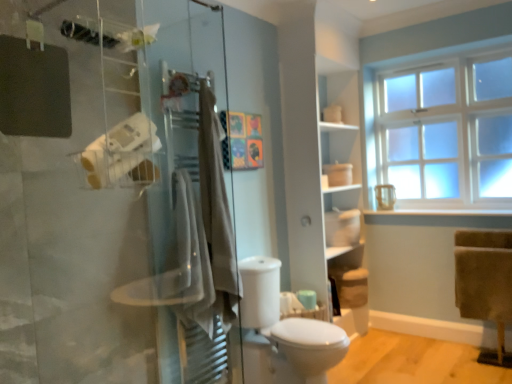
Question: Considering the relative sizes of beige cotton bath towel at center, which ranks as the second bath towel in back-to-front order, and white matte shelf at center in the image provided, is beige cotton bath towel at center, which ranks as the second bath towel in back-to-front order, smaller than white matte shelf at center?

Choices:
 (A) yes
 (B) no

Answer: (A)

Question: Does beige cotton bath towel at center, the 1th bath towel when ordered from front to back, have a larger size compared to white matte shelf at center?

Choices:
 (A) no
 (B) yes

Answer: (A)

Question: Is there a large distance between beige cotton bath towel at center, which ranks as the second bath towel in back-to-front order, and white matte shelf at center?

Choices:
 (A) no
 (B) yes

Answer: (B)

Question: From the image's perspective, is beige cotton bath towel at center, the 1th bath towel when ordered from front to back, located above white matte shelf at center?

Choices:
 (A) yes
 (B) no

Answer: (B)

Question: Is beige cotton bath towel at center, which ranks as the second bath towel in back-to-front order, looking in the opposite direction of white matte shelf at center?

Choices:
 (A) no
 (B) yes

Answer: (A)

Question: From the image's perspective, relative to white matte shelf at center, is white frosted glass window at upper right above or below?

Choices:
 (A) above
 (B) below

Answer: (A)

Question: Would you say white frosted glass window at upper right is inside or outside white matte shelf at center?

Choices:
 (A) outside
 (B) inside

Answer: (A)

Question: Would you say white frosted glass window at upper right is to the left or to the right of white matte shelf at center in the picture?

Choices:
 (A) right
 (B) left

Answer: (A)

Question: In terms of width, does white frosted glass window at upper right look wider or thinner when compared to white matte shelf at center?

Choices:
 (A) thin
 (B) wide

Answer: (A)

Question: From a real-world perspective, is white matte shelf at center above or below white frosted glass window at upper right?

Choices:
 (A) above
 (B) below

Answer: (B)

Question: Does point (355, 193) appear closer or farther from the camera than point (374, 84)?

Choices:
 (A) closer
 (B) farther

Answer: (A)

Question: Relative to white frosted glass window at upper right, is white matte shelf at center in front or behind?

Choices:
 (A) behind
 (B) front

Answer: (B)

Question: Is white matte shelf at center taller or shorter than white frosted glass window at upper right?

Choices:
 (A) short
 (B) tall

Answer: (B)

Question: Would you say white matte toilet paper at left is to the left or to the right of beige cotton bath towel at center, which ranks as the second bath towel in back-to-front order, in the picture?

Choices:
 (A) left
 (B) right

Answer: (A)

Question: Looking at their shapes, would you say white matte toilet paper at left is wider or thinner than beige cotton bath towel at center, which ranks as the second bath towel in back-to-front order?

Choices:
 (A) wide
 (B) thin

Answer: (B)